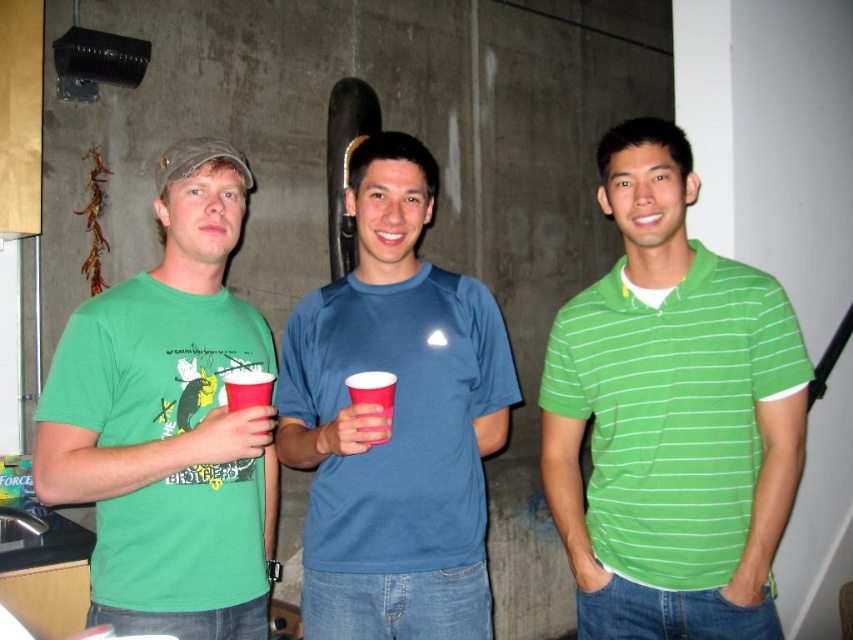
Question: Which object appears closest to the camera in this image?

Choices:
 (A) green striped polo shirt at center
 (B) blue matte t-shirt at center
 (C) red plastic cup at center
 (D) matte plastic cup at center

Answer: (D)

Question: Is the position of matte plastic cup at center more distant than that of red plastic cup at center?

Choices:
 (A) yes
 (B) no

Answer: (B)

Question: Is the position of blue matte t-shirt at center more distant than that of matte green t-shirt at left?

Choices:
 (A) yes
 (B) no

Answer: (B)

Question: Which object is closer to the camera taking this photo?

Choices:
 (A) matte green t-shirt at left
 (B) matte plastic cup at center
 (C) red plastic cup at center

Answer: (B)

Question: Is green striped polo shirt at center thinner than blue matte t-shirt at center?

Choices:
 (A) no
 (B) yes

Answer: (B)

Question: Based on their relative distances, which object is farther from the matte plastic cup at center?

Choices:
 (A) matte green t-shirt at left
 (B) green striped polo shirt at center
 (C) blue matte t-shirt at center

Answer: (B)